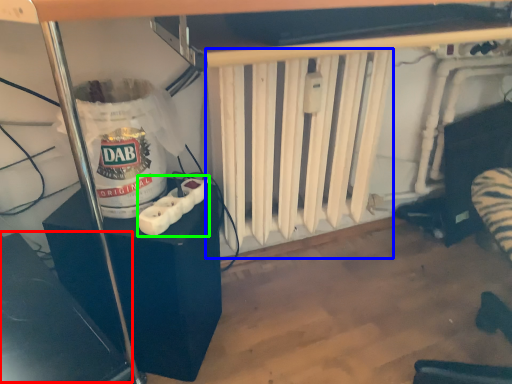
Question: Considering the real-world distances, which object is closest to wide (highlighted by a red box)? radiator (highlighted by a blue box) or Wii controller (highlighted by a green box).

Choices:
 (A) radiator
 (B) Wii controller

Answer: (B)